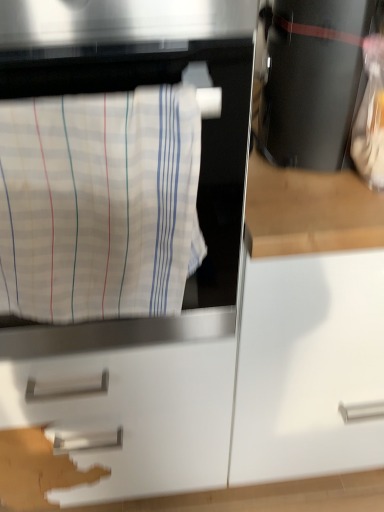
Locate an element on the screen. The height and width of the screenshot is (512, 384). black glossy coffee maker at upper right is located at coordinates (311, 80).

You are a GUI agent. You are given a task and a screenshot of the screen. Output one action in this format:
    pyautogui.click(x=<x>, y=<y>)
    Task: Click on the white striped fabric at left
    The image size is (384, 512).
    Given the screenshot: What is the action you would take?
    pyautogui.click(x=99, y=204)

Can you confirm if black glossy coffee maker at upper right is bigger than white striped fabric at left?

Yes.

Which object is thinner, black glossy coffee maker at upper right or white striped fabric at left?

Thinner between the two is white striped fabric at left.

From a real-world perspective, is black glossy coffee maker at upper right over white striped fabric at left?

Yes, from a real-world perspective, black glossy coffee maker at upper right is above white striped fabric at left.

Who is shorter, black glossy coffee maker at upper right or white striped fabric at left?

black glossy coffee maker at upper right.

From the image's perspective, is white striped fabric at left under black glossy coffee maker at upper right?

Indeed, from the image's perspective, white striped fabric at left is shown beneath black glossy coffee maker at upper right.

Considering the positions of objects white striped fabric at left and black glossy coffee maker at upper right in the image provided, who is more to the left, white striped fabric at left or black glossy coffee maker at upper right?

Positioned to the left is white striped fabric at left.

Is white striped fabric at left placed right next to black glossy coffee maker at upper right?

white striped fabric at left and black glossy coffee maker at upper right are not in contact.

Is white striped fabric at left further to camera compared to black glossy coffee maker at upper right?

No, white striped fabric at left is closer to the viewer.

From a real-world perspective, which object stands above the other?

white striped fabric at left, from a real-world perspective.

Could you tell me if white striped fabric at left is turned towards white matte drawer at center?

No.

What's the angular difference between white striped fabric at left and white matte drawer at center's facing directions?

They differ by 0.465 degrees in their facing directions.

Considering the relative sizes of white striped fabric at left and white matte drawer at center in the image provided, is white striped fabric at left thinner than white matte drawer at center?

Yes, white striped fabric at left is thinner than white matte drawer at center.

Is there a large distance between white matte drawer at center and black glossy coffee maker at upper right?

No, white matte drawer at center is in close proximity to black glossy coffee maker at upper right.

From the image's perspective, which is below, white matte drawer at center or black glossy coffee maker at upper right?

From the image's view, white matte drawer at center is below.

This screenshot has height=512, width=384. I want to click on appliance on the right of the white matte drawer at center, so click(311, 80).

Which object is more forward, white matte drawer at center or black glossy coffee maker at upper right?

black glossy coffee maker at upper right is more forward.

From the image's perspective, which object appears higher, black glossy coffee maker at upper right or white matte drawer at center?

From the image's view, black glossy coffee maker at upper right is above.

Between black glossy coffee maker at upper right and white matte drawer at center, which one has less height?

black glossy coffee maker at upper right.

How different are the orientations of black glossy coffee maker at upper right and white matte drawer at center in degrees?

There is a 0.594-degree angle between the facing directions of black glossy coffee maker at upper right and white matte drawer at center.

Based on the photo, can you confirm if black glossy coffee maker at upper right is positioned to the right of white matte drawer at center?

Indeed, black glossy coffee maker at upper right is positioned on the right side of white matte drawer at center.

Is white matte drawer at center outside of white striped fabric at left?

Yes.

In terms of width, does white matte drawer at center look wider or thinner when compared to white striped fabric at left?

In the image, white matte drawer at center appears to be wider than white striped fabric at left.

From the image's perspective, which one is positioned lower, white matte drawer at center or white striped fabric at left?

white matte drawer at center is shown below in the image.

Is white matte drawer at center bigger or smaller than white striped fabric at left?

Clearly, white matte drawer at center is larger in size than white striped fabric at left.

Find the location of `laundry located below the black glossy coffee maker at upper right (from the image's perspective)`. laundry located below the black glossy coffee maker at upper right (from the image's perspective) is located at coordinates (99, 204).

Find the location of a particular element. laundry in front of the black glossy coffee maker at upper right is located at coordinates (99, 204).

Based on their spatial positions, is white matte drawer at center or white striped fabric at left closer to black glossy coffee maker at upper right?

Based on the image, white striped fabric at left appears to be nearer to black glossy coffee maker at upper right.

In the scene shown: Based on their spatial positions, is white striped fabric at left or white matte drawer at center further from black glossy coffee maker at upper right?

white matte drawer at center lies further to black glossy coffee maker at upper right than the other object.

From the image, which object appears to be farther from white striped fabric at left, white matte drawer at center or black glossy coffee maker at upper right?

white matte drawer at center.

Based on their spatial positions, is black glossy coffee maker at upper right or white striped fabric at left closer to white matte drawer at center?

Based on the image, white striped fabric at left appears to be nearer to white matte drawer at center.

Estimate the real-world distances between objects in this image. Which object is further from white matte drawer at center, white striped fabric at left or black glossy coffee maker at upper right?

black glossy coffee maker at upper right is further to white matte drawer at center.

Looking at the image, which one is located further to white striped fabric at left, black glossy coffee maker at upper right or white matte drawer at center?

Based on the image, white matte drawer at center appears to be further to white striped fabric at left.

This screenshot has height=512, width=384. What are the coordinates of `laundry between black glossy coffee maker at upper right and white matte drawer at center in the up-down direction` in the screenshot? It's located at (99, 204).